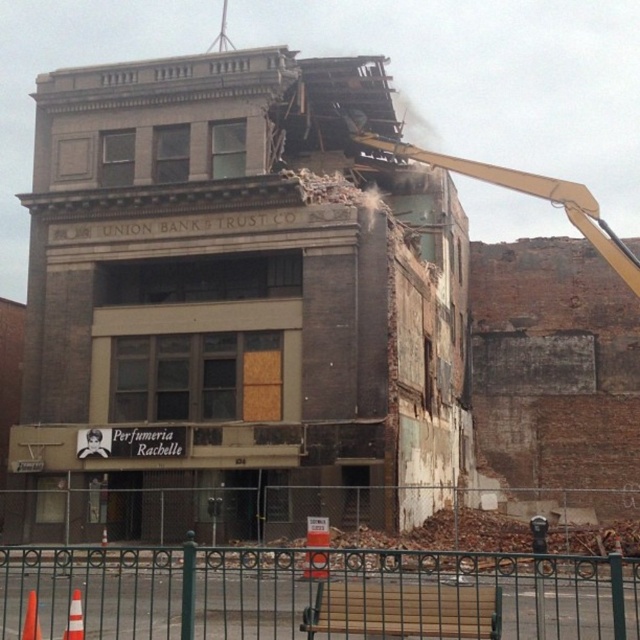
Question: Is green metal fence at lower center below white plastic construction worker at center?

Choices:
 (A) no
 (B) yes

Answer: (B)

Question: Which is farther from the green metal fence at lower center?

Choices:
 (A) wooden bench at lower center
 (B) white plastic construction worker at center

Answer: (B)

Question: From the image, what is the correct spatial relationship of wooden bench at lower center in relation to white plastic construction worker at center?

Choices:
 (A) left
 (B) right

Answer: (B)

Question: Which object appears farthest from the camera in this image?

Choices:
 (A) white plastic construction worker at center
 (B) wooden bench at lower center

Answer: (A)

Question: Is wooden bench at lower center bigger than white plastic construction worker at center?

Choices:
 (A) no
 (B) yes

Answer: (B)

Question: Which is farther from the green metal fence at lower center?

Choices:
 (A) wooden bench at lower center
 (B) white plastic construction worker at center

Answer: (B)